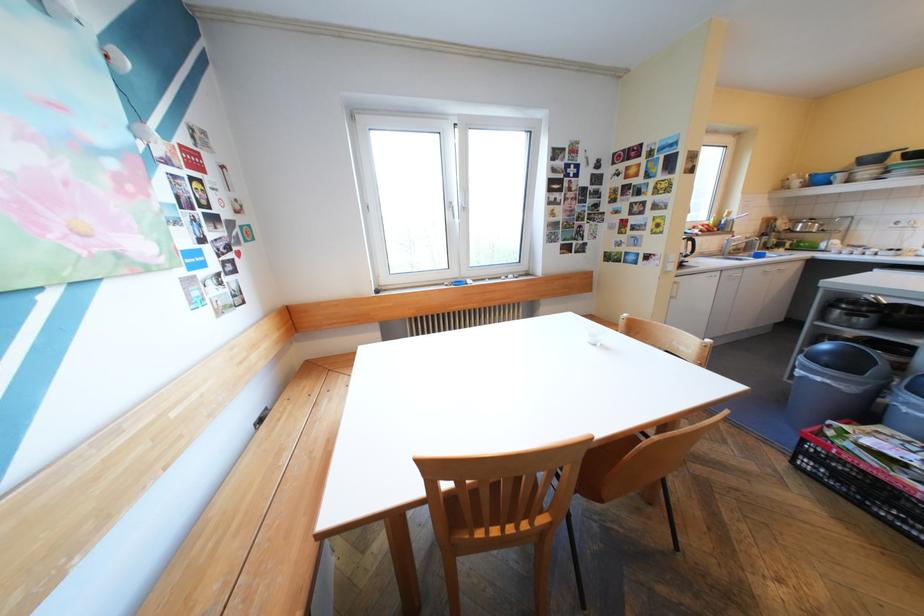
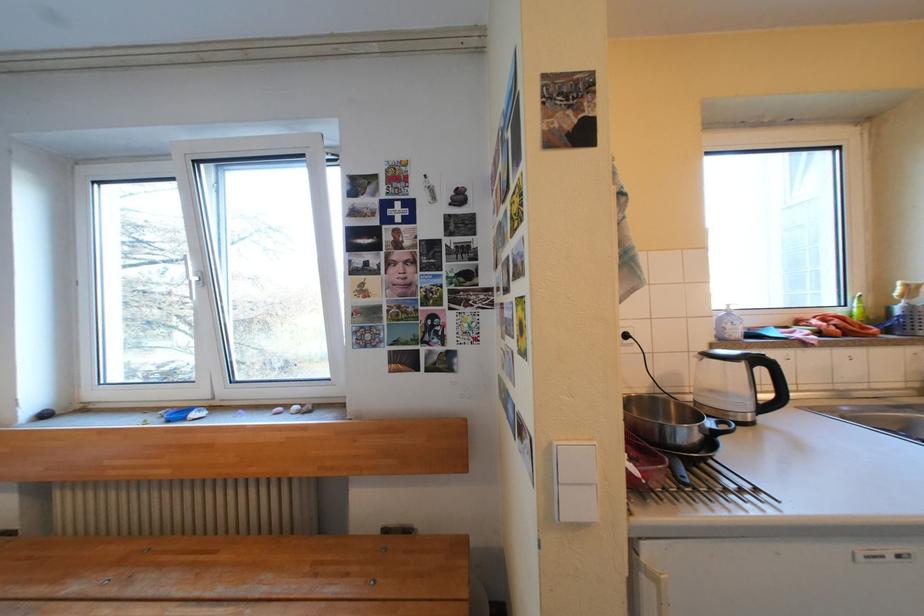
Which direction would the cameraman need to move to produce the second image?

The cameraman moved toward right, forward.